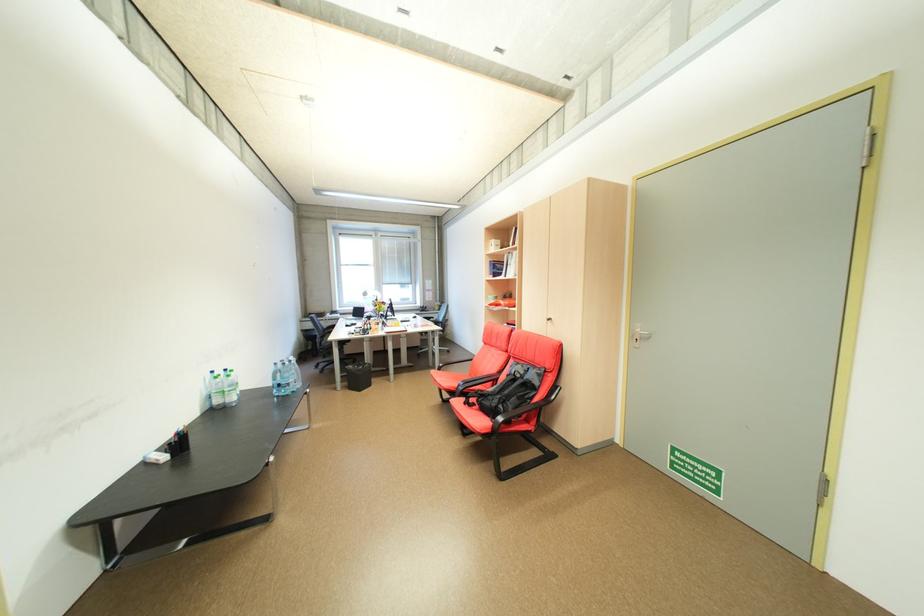
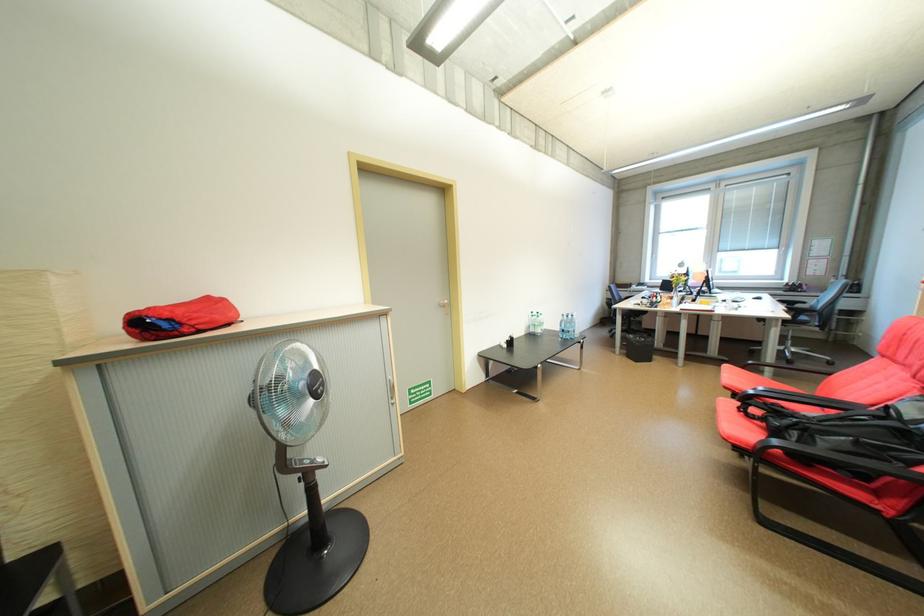
The point at (226,402) is marked in the first image. Where is the corresponding point in the second image?

(541, 331)